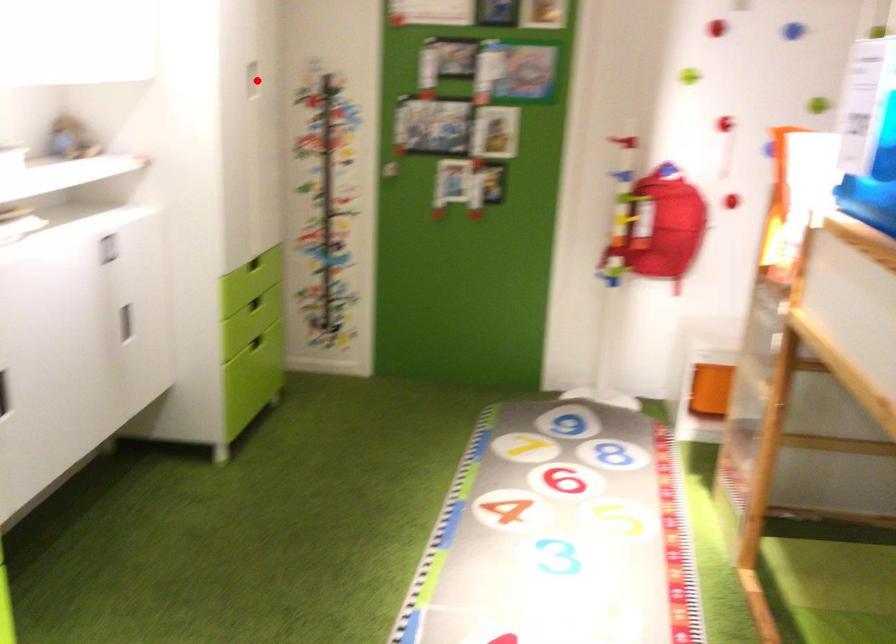
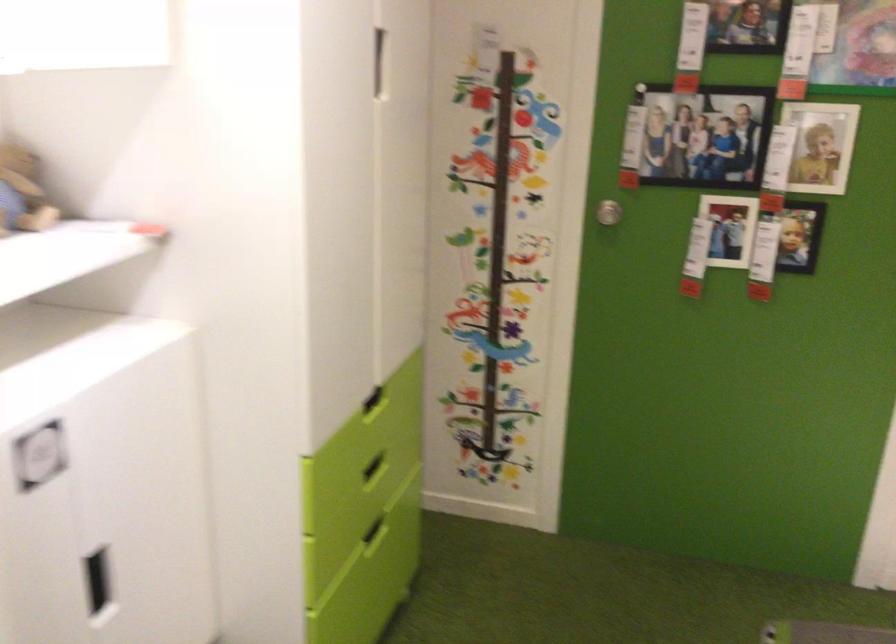
Where in the second image is the point corresponding to the highlighted location from the first image?

(377, 61)